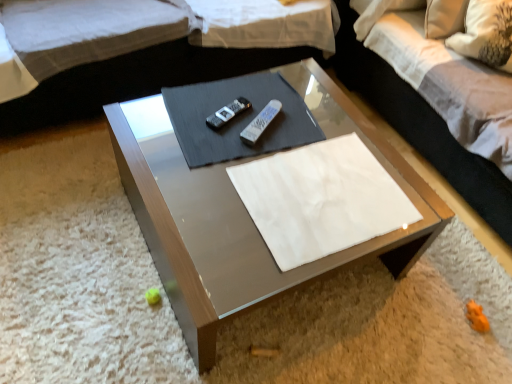
Identify the location of vacant space behind black plastic remote at center, arranged as the second remote when viewed from the right. The width and height of the screenshot is (512, 384). (246, 87).